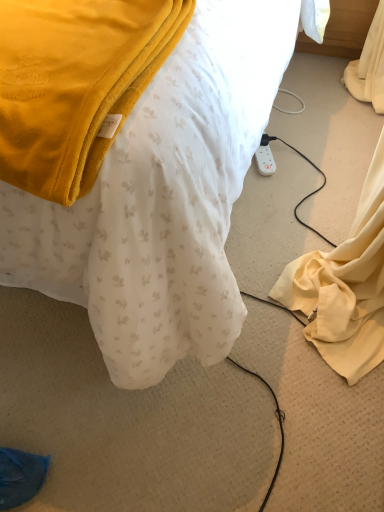
The height and width of the screenshot is (512, 384). Describe the element at coordinates (161, 204) in the screenshot. I see `velvet yellow blanket at upper left` at that location.

Identify the location of velvet yellow blanket at upper left. This screenshot has width=384, height=512. (161, 204).

At what (x,y) coordinates should I click in order to perform the action: click on velvet yellow blanket at upper left. Please return your answer as a coordinate pair (x, y). Looking at the image, I should click on (161, 204).